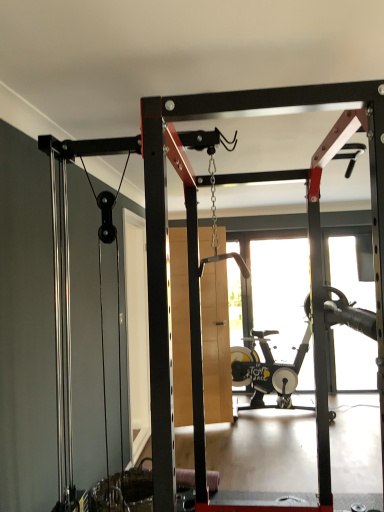
Question: From a real-world perspective, does black rubber stationary bicycle at center stand above wooden at center?

Choices:
 (A) yes
 (B) no

Answer: (B)

Question: Is black rubber stationary bicycle at center shorter than wooden at center?

Choices:
 (A) no
 (B) yes

Answer: (B)

Question: Does black rubber stationary bicycle at center have a lesser width compared to wooden at center?

Choices:
 (A) yes
 (B) no

Answer: (B)

Question: Is black rubber stationary bicycle at center not within wooden at center?

Choices:
 (A) yes
 (B) no

Answer: (A)

Question: Is black rubber stationary bicycle at center at the left side of wooden at center?

Choices:
 (A) yes
 (B) no

Answer: (B)

Question: Does black rubber stationary bicycle at center have a smaller size compared to wooden at center?

Choices:
 (A) no
 (B) yes

Answer: (A)

Question: Considering the relative sizes of wooden at center and black rubber stationary bicycle at center in the image provided, is wooden at center wider than black rubber stationary bicycle at center?

Choices:
 (A) yes
 (B) no

Answer: (B)

Question: Can you confirm if wooden at center is bigger than black rubber stationary bicycle at center?

Choices:
 (A) yes
 (B) no

Answer: (B)

Question: From the image's perspective, would you say wooden at center is shown under black rubber stationary bicycle at center?

Choices:
 (A) no
 (B) yes

Answer: (A)

Question: Is wooden at center facing away from black rubber stationary bicycle at center?

Choices:
 (A) yes
 (B) no

Answer: (B)

Question: Is wooden at center positioned before black rubber stationary bicycle at center?

Choices:
 (A) no
 (B) yes

Answer: (B)

Question: Can you confirm if wooden at center is thinner than black rubber stationary bicycle at center?

Choices:
 (A) yes
 (B) no

Answer: (A)

Question: Looking at their shapes, would you say black rubber stationary bicycle at center is wider or thinner than wooden at center?

Choices:
 (A) wide
 (B) thin

Answer: (A)